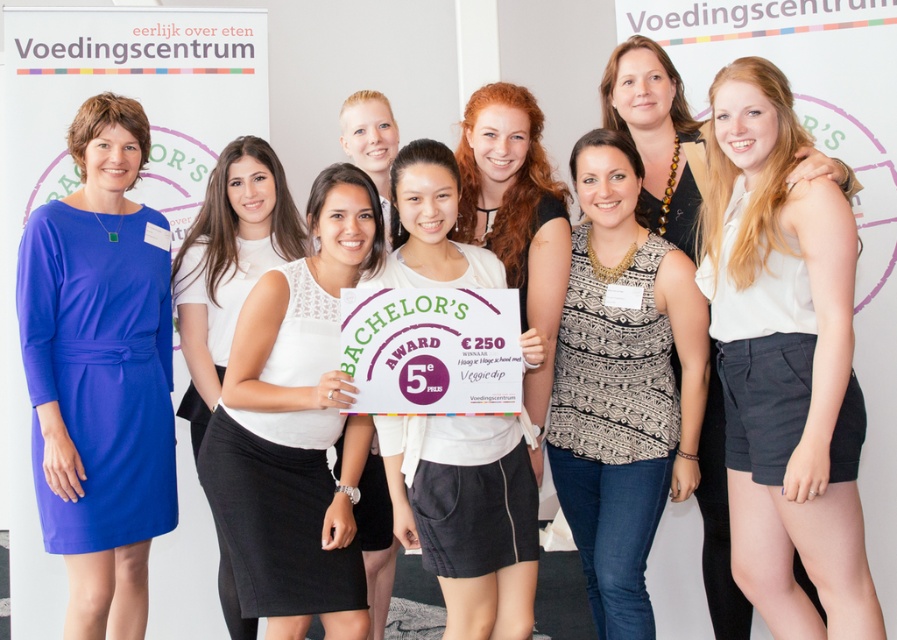
Question: Estimate the real-world distances between objects in this image. Which object is farther from the matte blue dress at left?

Choices:
 (A) white cotton blouse at center
 (B) black printed tank top at center

Answer: (A)

Question: Is white lace top at center bigger than black printed tank top at center?

Choices:
 (A) no
 (B) yes

Answer: (B)

Question: Among these objects, which one is farthest from the camera?

Choices:
 (A) blonde hair at center
 (B) white matte shirt at center

Answer: (A)

Question: Among these objects, which one is nearest to the camera?

Choices:
 (A) white lace top at center
 (B) white cotton blouse at center

Answer: (B)

Question: Can you confirm if white cotton blouse at center is positioned to the right of white matte shirt at center?

Choices:
 (A) yes
 (B) no

Answer: (A)

Question: Can you confirm if matte blue dress at left is positioned above black printed tank top at center?

Choices:
 (A) yes
 (B) no

Answer: (A)